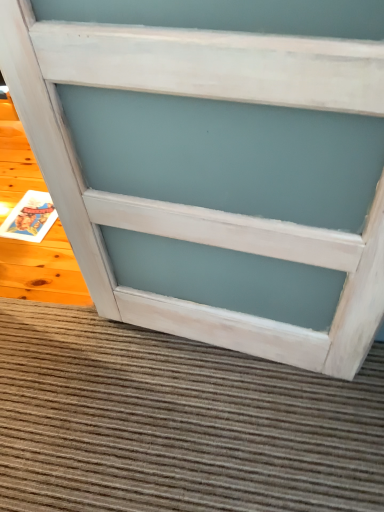
What do you see at coordinates (215, 165) in the screenshot?
I see `white painted wood cabinet at lower center` at bounding box center [215, 165].

In order to click on white painted wood cabinet at lower center in this screenshot , I will do `click(215, 165)`.

Measure the distance between white painted wood cabinet at lower center and camera.

They are 22.87 inches apart.

Where is `white painted wood cabinet at lower center`? white painted wood cabinet at lower center is located at coordinates (215, 165).